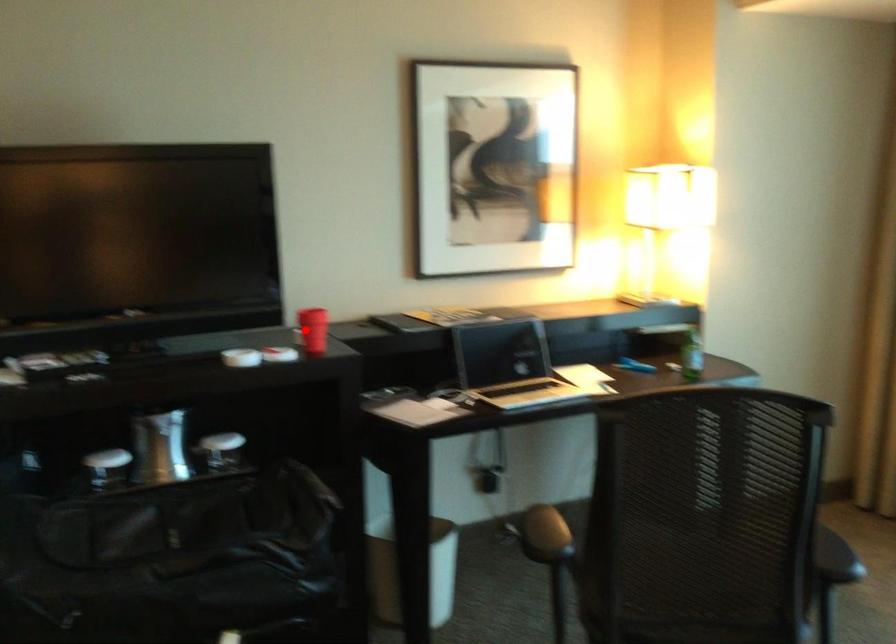
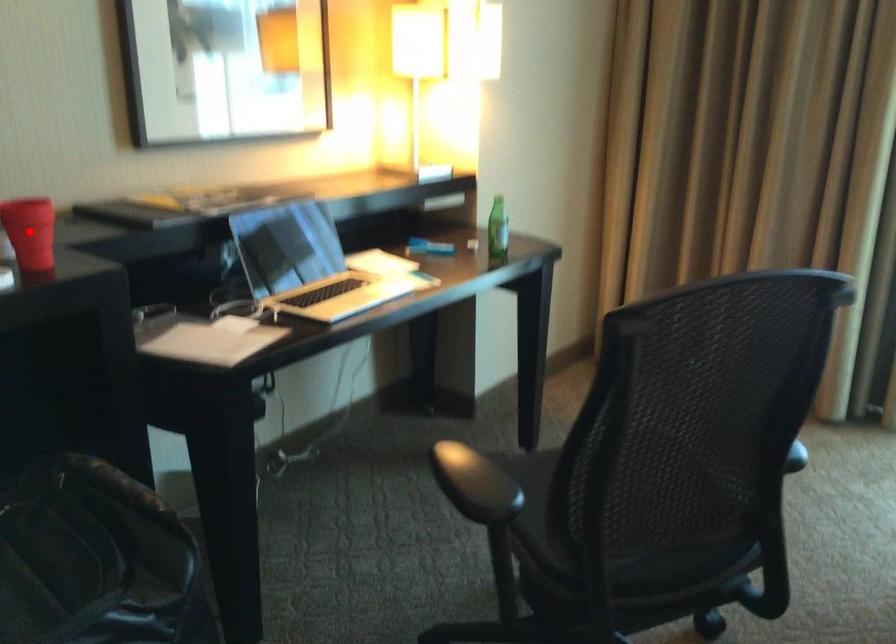
I am providing you with two images of the same scene from different viewpoints. A red point is marked on the first image and another point is marked on the second image. Does the point marked in image1 correspond to the same location as the one in image2?

Yes